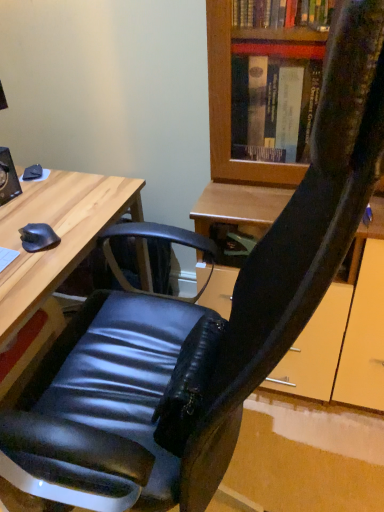
At what (x,y) coordinates should I click in order to perform the action: click on free space in front of matte black mouse at left. Please return your answer as a coordinate pair (x, y). Image resolution: width=384 pixels, height=512 pixels. Looking at the image, I should click on (30, 274).